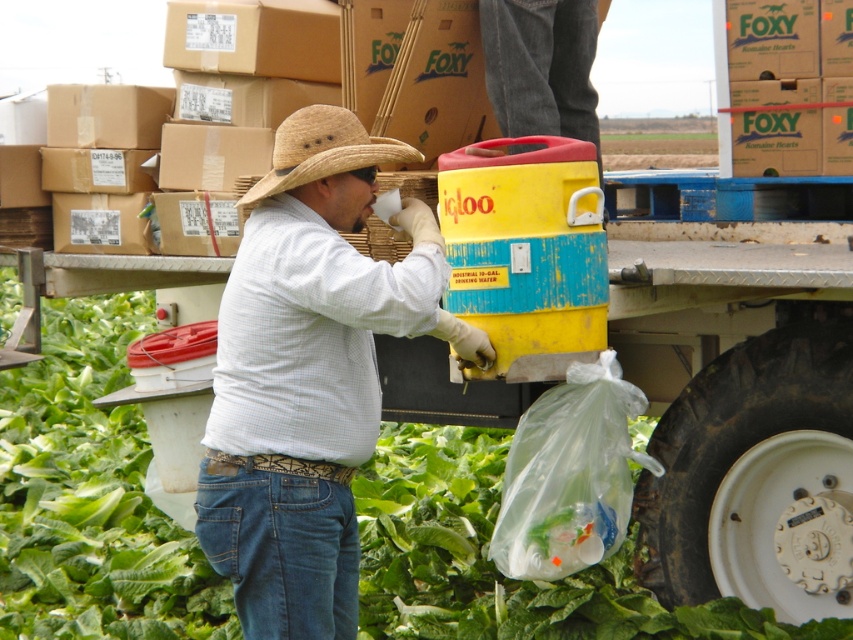
Does matte straw hat at center have a smaller size compared to straw hat at center?

Incorrect, matte straw hat at center is not smaller in size than straw hat at center.

What do you see at coordinates (309, 372) in the screenshot?
I see `matte straw hat at center` at bounding box center [309, 372].

Is point (442, 310) in front of point (335, 173)?

No, (442, 310) is behind (335, 173).

You are a GUI agent. You are given a task and a screenshot of the screen. Output one action in this format:
    pyautogui.click(x=<x>, y=<y>)
    Task: Click on the matte straw hat at center
    This screenshot has height=640, width=853.
    Given the screenshot: What is the action you would take?
    pyautogui.click(x=309, y=372)

Can you confirm if green leafy vegetable at center is shorter than straw hat at center?

Incorrect, green leafy vegetable at center's height does not fall short of straw hat at center's.

Can you confirm if green leafy vegetable at center is taller than straw hat at center?

Yes, green leafy vegetable at center is taller than straw hat at center.

Is point (419, 483) positioned before point (363, 136)?

No.

At what (x,y) coordinates should I click in order to perform the action: click on green leafy vegetable at center. Please return your answer as a coordinate pair (x, y). The width and height of the screenshot is (853, 640). Looking at the image, I should click on (91, 496).

Does green leafy vegetable at center have a greater width compared to denim jeans at lower center?

Correct, the width of green leafy vegetable at center exceeds that of denim jeans at lower center.

Describe the element at coordinates (91, 496) in the screenshot. I see `green leafy vegetable at center` at that location.

You are a GUI agent. You are given a task and a screenshot of the screen. Output one action in this format:
    pyautogui.click(x=<x>, y=<y>)
    Task: Click on the green leafy vegetable at center
    
    Given the screenshot: What is the action you would take?
    pyautogui.click(x=91, y=496)